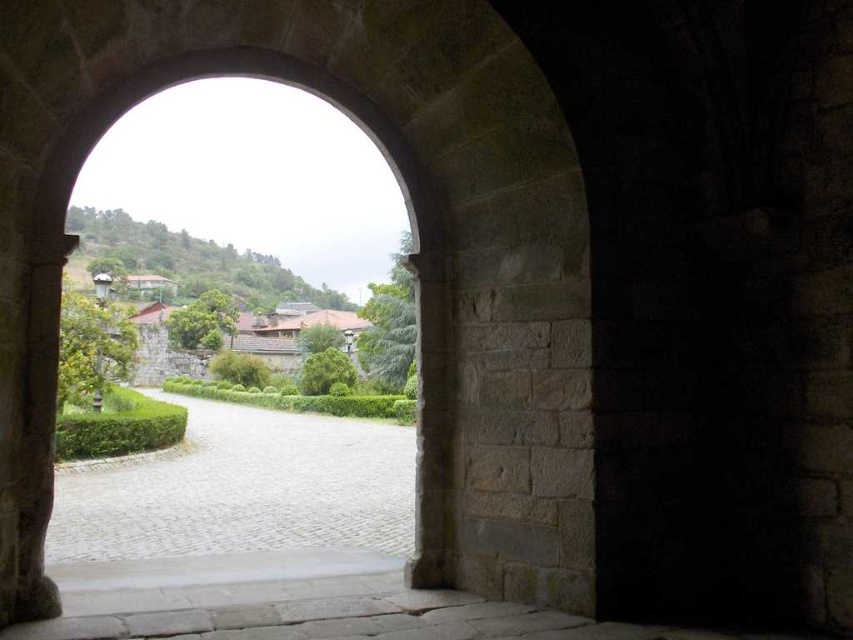
You are standing at the entrance of the courtyard and want to walk towards the buildings in the background. Which object, the paved stone path at center or the stone archway at center, will you step onto first?

The paved stone path at center has a greater height compared to the stone archway at center, so you will step onto the paved stone path at center first.

In the scene shown: You are a tour guide leading a group through a historical site. You want to inform your group about the distance between the paved stone path at center and the stone archway at center. What do you tell them?

The paved stone path at center is 30.82 meters away from the stone archway at center.